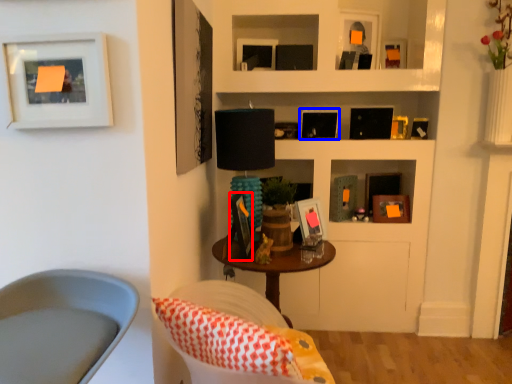
Question: Which point is closer to the camera, picture frame (highlighted by a red box) or picture frame (highlighted by a blue box)?

Choices:
 (A) picture frame
 (B) picture frame

Answer: (A)